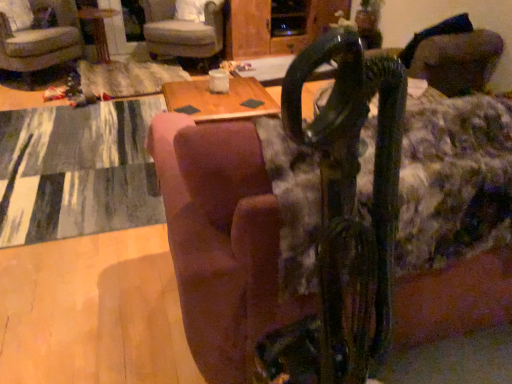
Image resolution: width=512 pixels, height=384 pixels. What do you see at coordinates (98, 29) in the screenshot? I see `wooden table at center` at bounding box center [98, 29].

The image size is (512, 384). I want to click on velvet beige armchair at upper left, which appears as the 1th chair when viewed from the left, so click(x=41, y=41).

At what (x,y) coordinates should I click in order to perform the action: click on textured gray rug at lower left. Please return your answer as a coordinate pair (x, y). Looking at the image, I should click on (77, 171).

The width and height of the screenshot is (512, 384). Describe the element at coordinates (221, 241) in the screenshot. I see `brown fabric couch at center` at that location.

Describe the element at coordinates (184, 34) in the screenshot. Image resolution: width=512 pixels, height=384 pixels. I see `velvet-like gray armchair at upper center, which is the first chair in right-to-left order` at that location.

Locate an element on the screen. This screenshot has width=512, height=384. wooden table at center is located at coordinates (98, 29).

Is wooden table at center taller than velvet-like gray armchair at upper center, which is the first chair in right-to-left order?

In fact, wooden table at center may be shorter than velvet-like gray armchair at upper center, which is the first chair in right-to-left order.

Between wooden table at center and velvet-like gray armchair at upper center, arranged as the second chair when viewed from the left, which one appears on the left side from the viewer's perspective?

wooden table at center is more to the left.

Between wooden table at center and velvet-like gray armchair at upper center, arranged as the second chair when viewed from the left, which one has smaller width?

wooden table at center is thinner.

Could textured gray rug at lower left be considered to be inside velvet beige armchair at upper left, which appears as the 1th chair when viewed from the left?

Definitely not — textured gray rug at lower left is not inside velvet beige armchair at upper left, which appears as the 1th chair when viewed from the left.

Starting from the textured gray rug at lower left, which chair is the 1st one behind? Please provide its 2D coordinates.

[(41, 41)]

Between velvet beige armchair at upper left, placed as the second chair when sorted from right to left, and textured gray rug at lower left, which one has smaller size?

Smaller between the two is textured gray rug at lower left.

Are velvet beige armchair at upper left, placed as the second chair when sorted from right to left, and textured gray rug at lower left far apart?

Yes, velvet beige armchair at upper left, placed as the second chair when sorted from right to left, is far from textured gray rug at lower left.

Is velvet-like gray armchair at upper center, arranged as the second chair when viewed from the left, shorter than wooden table at center?

In fact, velvet-like gray armchair at upper center, arranged as the second chair when viewed from the left, may be taller than wooden table at center.

From the image's perspective, which is above, velvet-like gray armchair at upper center, which is the first chair in right-to-left order, or wooden table at center?

velvet-like gray armchair at upper center, which is the first chair in right-to-left order, appears higher in the image.

From the picture: Is velvet-like gray armchair at upper center, which is the first chair in right-to-left order, spatially inside wooden table at center, or outside of it?

velvet-like gray armchair at upper center, which is the first chair in right-to-left order, lies outside wooden table at center.

Looking at their sizes, would you say velvet-like gray armchair at upper center, which is the first chair in right-to-left order, is wider or thinner than wooden table at center?

velvet-like gray armchair at upper center, which is the first chair in right-to-left order, is wider than wooden table at center.

Is wooden table at center bigger than velvet beige armchair at upper left, placed as the second chair when sorted from right to left?

No, wooden table at center is not bigger than velvet beige armchair at upper left, placed as the second chair when sorted from right to left.

Based on the photo, is wooden table at center wider or thinner than velvet beige armchair at upper left, placed as the second chair when sorted from right to left?

In the image, wooden table at center appears to be more narrow than velvet beige armchair at upper left, placed as the second chair when sorted from right to left.

Can you tell me how much wooden table at center and velvet beige armchair at upper left, placed as the second chair when sorted from right to left, differ in facing direction?

The angular difference between wooden table at center and velvet beige armchair at upper left, placed as the second chair when sorted from right to left, is 39.5 degrees.

Relative to velvet beige armchair at upper left, placed as the second chair when sorted from right to left, is wooden table at center in front or behind?

wooden table at center is behind velvet beige armchair at upper left, placed as the second chair when sorted from right to left.

From a real-world perspective, which is physically above, textured gray rug at lower left or velvet beige armchair at upper left, which appears as the 1th chair when viewed from the left?

velvet beige armchair at upper left, which appears as the 1th chair when viewed from the left, from a real-world perspective.

From the image's perspective, would you say textured gray rug at lower left is positioned over velvet beige armchair at upper left, which appears as the 1th chair when viewed from the left?

Incorrect, from the image's perspective, textured gray rug at lower left is lower than velvet beige armchair at upper left, which appears as the 1th chair when viewed from the left.

Can you confirm if textured gray rug at lower left is positioned to the right of velvet beige armchair at upper left, which appears as the 1th chair when viewed from the left?

Yes.

Does textured gray rug at lower left have a smaller size compared to velvet beige armchair at upper left, placed as the second chair when sorted from right to left?

Indeed, textured gray rug at lower left has a smaller size compared to velvet beige armchair at upper left, placed as the second chair when sorted from right to left.

Considering the relative positions of brown fabric couch at center and velvet beige armchair at upper left, which appears as the 1th chair when viewed from the left, in the image provided, is brown fabric couch at center in front of velvet beige armchair at upper left, which appears as the 1th chair when viewed from the left,?

Yes, it is in front of velvet beige armchair at upper left, which appears as the 1th chair when viewed from the left.

Considering the sizes of objects brown fabric couch at center and velvet beige armchair at upper left, placed as the second chair when sorted from right to left, in the image provided, who is taller, brown fabric couch at center or velvet beige armchair at upper left, placed as the second chair when sorted from right to left,?

brown fabric couch at center is taller.

Are brown fabric couch at center and velvet beige armchair at upper left, placed as the second chair when sorted from right to left, far apart?

Yes.

From the picture: Can you confirm if velvet beige armchair at upper left, placed as the second chair when sorted from right to left, is bigger than wooden table at center?

Yes, velvet beige armchair at upper left, placed as the second chair when sorted from right to left, is bigger than wooden table at center.

Considering the relative positions of velvet beige armchair at upper left, which appears as the 1th chair when viewed from the left, and wooden table at center in the image provided, is velvet beige armchair at upper left, which appears as the 1th chair when viewed from the left, to the left of wooden table at center from the viewer's perspective?

Yes.

From a real-world perspective, which is physically above, velvet beige armchair at upper left, which appears as the 1th chair when viewed from the left, or wooden table at center?

velvet beige armchair at upper left, which appears as the 1th chair when viewed from the left, from a real-world perspective.

Considering the sizes of objects velvet beige armchair at upper left, placed as the second chair when sorted from right to left, and wooden table at center in the image provided, who is wider, velvet beige armchair at upper left, placed as the second chair when sorted from right to left, or wooden table at center?

velvet beige armchair at upper left, placed as the second chair when sorted from right to left, is wider.

Identify the location of table below the velvet-like gray armchair at upper center, which is the first chair in right-to-left order (from the image's perspective). (98, 29).

Identify the location of chair that is the 1st object located above the textured gray rug at lower left (from the image's perspective). The height and width of the screenshot is (384, 512). (41, 41).

Based on their spatial positions, is velvet-like gray armchair at upper center, which is the first chair in right-to-left order, or velvet beige armchair at upper left, placed as the second chair when sorted from right to left, closer to textured gray rug at lower left?

Among the two, velvet beige armchair at upper left, placed as the second chair when sorted from right to left, is located nearer to textured gray rug at lower left.

From the picture: Based on their spatial positions, is wooden table at center or textured gray rug at lower left closer to brown fabric couch at center?

Among the two, textured gray rug at lower left is located nearer to brown fabric couch at center.

Considering their positions, is textured gray rug at lower left positioned closer to velvet beige armchair at upper left, which appears as the 1th chair when viewed from the left, than wooden table at center?

Among the two, wooden table at center is located nearer to velvet beige armchair at upper left, which appears as the 1th chair when viewed from the left.

From the image, which object appears to be nearer to velvet-like gray armchair at upper center, which is the first chair in right-to-left order, textured gray rug at lower left or brown fabric couch at center?

textured gray rug at lower left lies closer to velvet-like gray armchair at upper center, which is the first chair in right-to-left order, than the other object.

Considering their positions, is brown fabric couch at center positioned closer to velvet-like gray armchair at upper center, arranged as the second chair when viewed from the left, than velvet beige armchair at upper left, which appears as the 1th chair when viewed from the left?

Among the two, velvet beige armchair at upper left, which appears as the 1th chair when viewed from the left, is located nearer to velvet-like gray armchair at upper center, arranged as the second chair when viewed from the left.

Which object lies further to the anchor point wooden table at center, velvet-like gray armchair at upper center, which is the first chair in right-to-left order, or textured gray rug at lower left?

Among the two, textured gray rug at lower left is located further to wooden table at center.

Looking at the image, which one is located closer to velvet-like gray armchair at upper center, arranged as the second chair when viewed from the left, wooden table at center or textured gray rug at lower left?

Based on the image, wooden table at center appears to be nearer to velvet-like gray armchair at upper center, arranged as the second chair when viewed from the left.

Estimate the real-world distances between objects in this image. Which object is further from brown fabric couch at center, textured gray rug at lower left or velvet beige armchair at upper left, which appears as the 1th chair when viewed from the left?

velvet beige armchair at upper left, which appears as the 1th chair when viewed from the left.

The image size is (512, 384). I want to click on chair positioned between brown fabric couch at center and velvet-like gray armchair at upper center, which is the first chair in right-to-left order, from near to far, so tap(41, 41).

The width and height of the screenshot is (512, 384). I want to click on table between velvet beige armchair at upper left, which appears as the 1th chair when viewed from the left, and velvet-like gray armchair at upper center, arranged as the second chair when viewed from the left, from left to right, so click(x=98, y=29).

Where is `mat between brown fabric couch at center and wooden table at center along the z-axis`? mat between brown fabric couch at center and wooden table at center along the z-axis is located at coordinates (77, 171).

Where is `mat located between brown fabric couch at center and velvet-like gray armchair at upper center, arranged as the second chair when viewed from the left, in the depth direction`? The height and width of the screenshot is (384, 512). mat located between brown fabric couch at center and velvet-like gray armchair at upper center, arranged as the second chair when viewed from the left, in the depth direction is located at coordinates (77, 171).